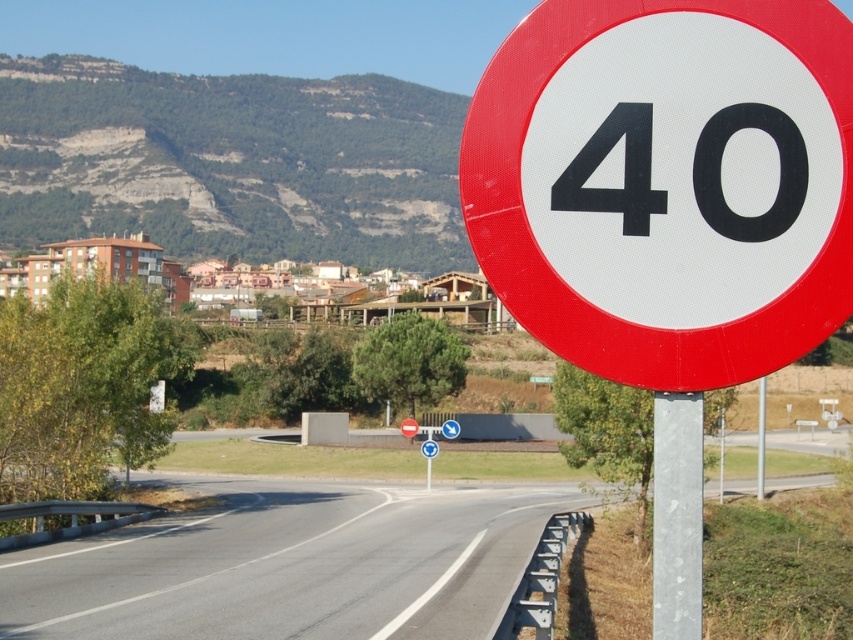
Question: Where is red plastic speed limit sign at center located in relation to metallic pole at center in the image?

Choices:
 (A) above
 (B) below

Answer: (A)

Question: Among these objects, which one is nearest to the camera?

Choices:
 (A) metallic pole at center
 (B) asphalt road at center
 (C) blackmaterial/texture40 at upper right
 (D) metallic gray pole at center-right

Answer: (D)

Question: Is blackmaterial/texturenumber at center to the right of blackmaterial/texture40 at upper right from the viewer's perspective?

Choices:
 (A) yes
 (B) no

Answer: (A)

Question: Can you confirm if asphalt road at center is positioned below blackmaterial/texture40 at upper right?

Choices:
 (A) yes
 (B) no

Answer: (A)

Question: Considering the real-world distances, which object is closest to the blackmaterial/texturenumber at center?

Choices:
 (A) blackmaterial/texture40 at upper right
 (B) red plastic speed limit sign at center

Answer: (A)

Question: Which object appears closest to the camera in this image?

Choices:
 (A) metallic pole at center
 (B) red plastic speed limit sign at center

Answer: (B)